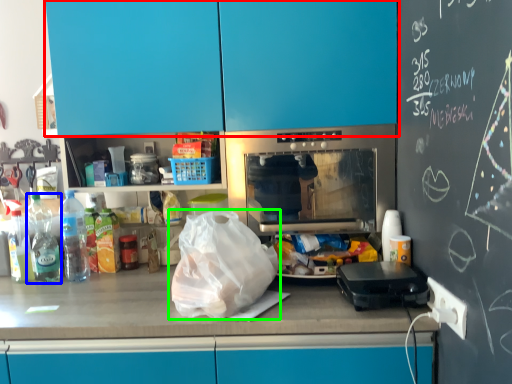
Question: Based on their relative distances, which object is nearer to cabinetry (highlighted by a red box)? Choose from bottle (highlighted by a blue box) and plastic bag (highlighted by a green box).

Choices:
 (A) bottle
 (B) plastic bag

Answer: (B)